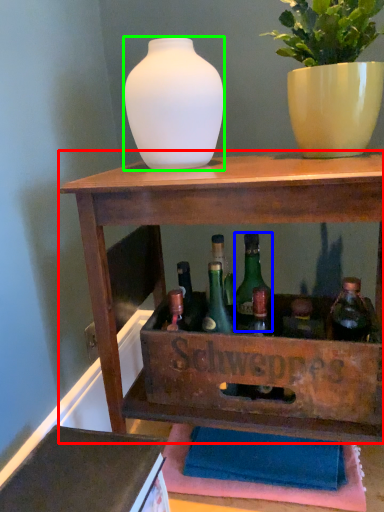
Question: Which object is the closest to the shelf (highlighted by a red box)? Choose among these: glass bottle (highlighted by a blue box) or vase (highlighted by a green box).

Choices:
 (A) glass bottle
 (B) vase

Answer: (A)